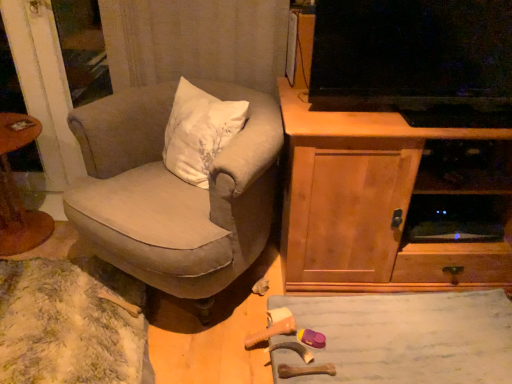
Question: Is wooden toy at lower center in front of or behind beige fabric chair at center in the image?

Choices:
 (A) front
 (B) behind

Answer: (B)

Question: Based on their positions, is wooden toy at lower center located to the left or right of beige fabric chair at center?

Choices:
 (A) left
 (B) right

Answer: (B)

Question: Estimate the real-world distances between objects in this image. Which object is closer to the beige fabric chair at center?

Choices:
 (A) wooden cabinet at right
 (B) wooden toy at lower center
 (C) wooden round table at left

Answer: (A)

Question: Which object is the closest to the wooden cabinet at right?

Choices:
 (A) wooden toy at lower center
 (B) beige fabric chair at center
 (C) wooden round table at left

Answer: (A)